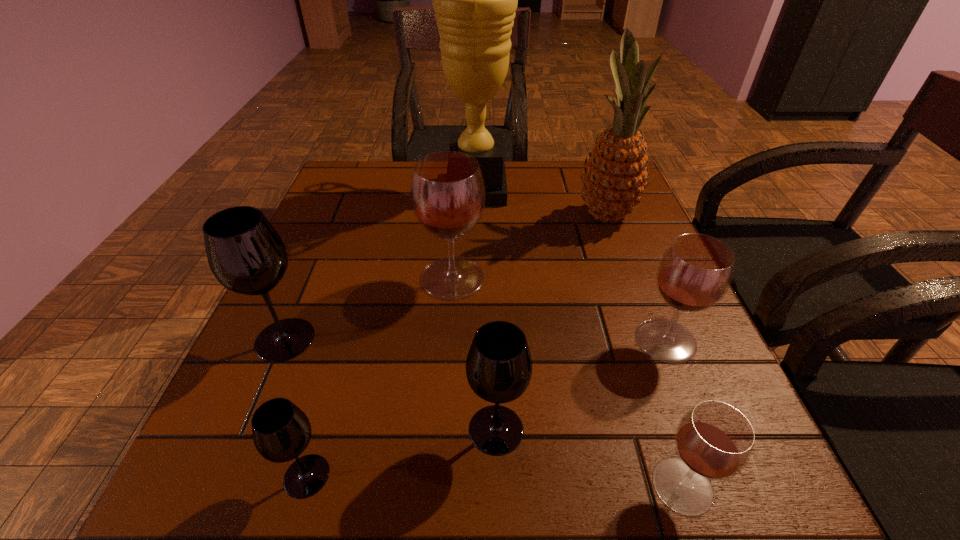
Identify the location of the second wineglass from left to right. (281, 431).

Identify the location of the nearest red wineglass. (714, 441).

I want to click on vacant space located at the front of the trophy cup with handles, so click(x=581, y=189).

You are a GUI agent. You are given a task and a screenshot of the screen. Output one action in this format:
    pyautogui.click(x=<x>, y=<y>)
    Task: Click on the free spot located 0.060m on the back of the pineapple
    This screenshot has width=960, height=540.
    Given the screenshot: What is the action you would take?
    pyautogui.click(x=594, y=185)

Where is `blank space located 0.060m on the right of the leftmost red wineglass`? This screenshot has width=960, height=540. blank space located 0.060m on the right of the leftmost red wineglass is located at coordinates (514, 278).

The width and height of the screenshot is (960, 540). I want to click on vacant area situated on the back of the farthest gray wineglass, so click(306, 288).

In order to click on free location located on the left of the second biggest red wineglass in this screenshot , I will do `click(563, 340)`.

The width and height of the screenshot is (960, 540). I want to click on free location located 0.280m on the right of the second smallest gray wineglass, so click(712, 429).

The width and height of the screenshot is (960, 540). Identify the location of vacant space located 0.130m on the back of the smallest gray wineglass. (335, 377).

The width and height of the screenshot is (960, 540). I want to click on blank space located 0.320m on the back of the nearest red wineglass, so click(620, 299).